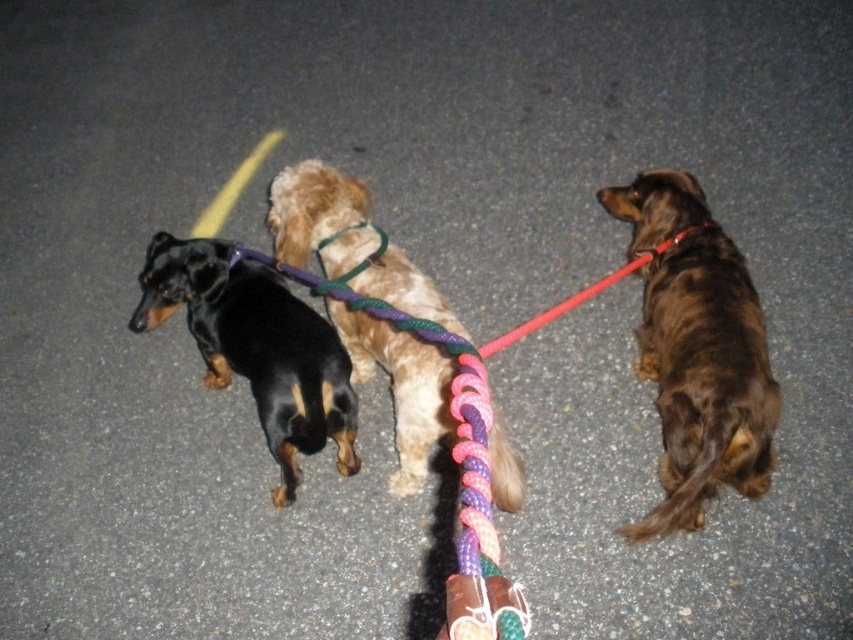
Is brown furry dog at right to the left of fuzzy brown dog at center from the viewer's perspective?

Incorrect, brown furry dog at right is not on the left side of fuzzy brown dog at center.

Does brown furry dog at right have a smaller size compared to fuzzy brown dog at center?

Yes, brown furry dog at right is smaller than fuzzy brown dog at center.

Where is `brown furry dog at right`? Image resolution: width=853 pixels, height=640 pixels. brown furry dog at right is located at coordinates (697, 352).

Is point (704, 230) farther from camera compared to point (221, 355)?

No.

Image resolution: width=853 pixels, height=640 pixels. Find the location of `brown furry dog at right`. brown furry dog at right is located at coordinates click(697, 352).

Does point (280, 449) lie behind point (387, 266)?

No.

Is black smooth dog at left closer to the viewer compared to fuzzy brown dog at center?

No, it is not.

Where is `black smooth dog at left`? black smooth dog at left is located at coordinates (256, 348).

This screenshot has height=640, width=853. In order to click on black smooth dog at left in this screenshot , I will do `click(256, 348)`.